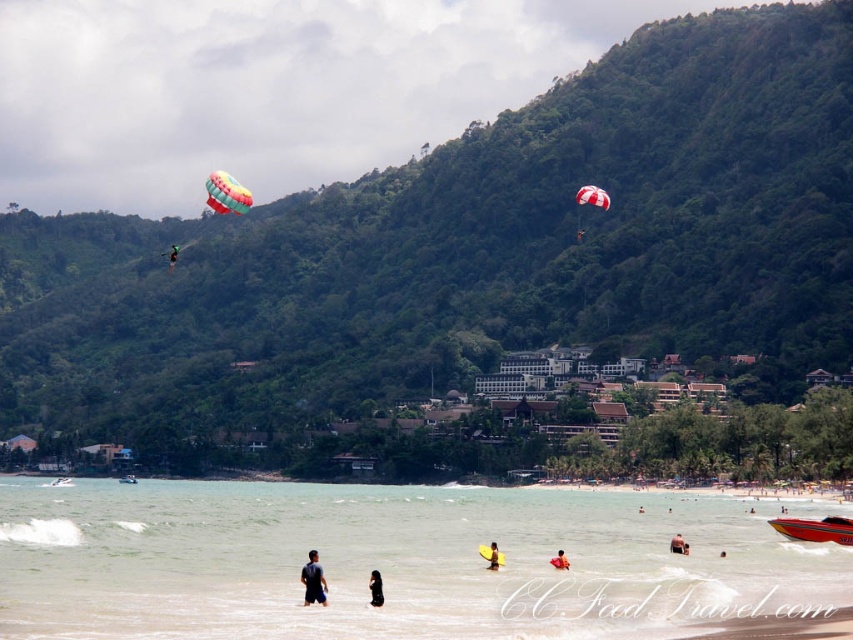
Question: Among these objects, which one is nearest to the camera?

Choices:
 (A) clear water at lower center
 (B) tan skin human at lower center
 (C) green fabric parachute at upper left
 (D) multicolored fabric parachute at upper center

Answer: (A)

Question: Does green leafy hillside at upper center come behind orange foam board at lower center?

Choices:
 (A) no
 (B) yes

Answer: (B)

Question: Which object is positioned closest to the green leafy hillside at upper center?

Choices:
 (A) orange foam board at lower center
 (B) multicolored fabric parachute at upper center
 (C) clear water at lower center
 (D) yellow foam board at lower center

Answer: (C)

Question: Is clear water at lower center positioned before green fabric parachute at upper left?

Choices:
 (A) yes
 (B) no

Answer: (A)

Question: Which of the following is the closest to the observer?

Choices:
 (A) dark blue fabric shirt at lower center
 (B) green fabric parachute at upper left

Answer: (A)

Question: Can you confirm if multicolored fabric parachute at upper center is positioned below yellow foam board at lower center?

Choices:
 (A) yes
 (B) no

Answer: (B)